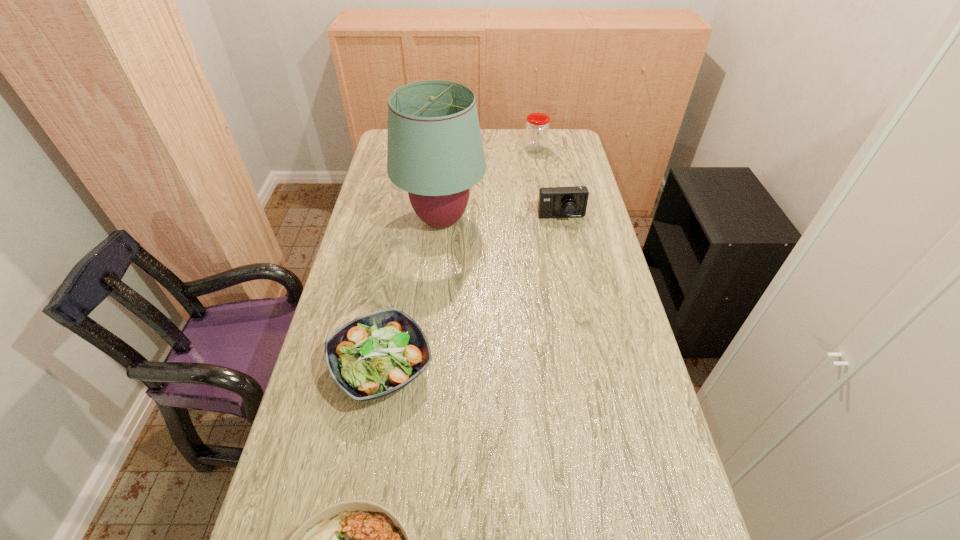
Where is `lampshade`? This screenshot has height=540, width=960. lampshade is located at coordinates (435, 152).

Where is `jar`? This screenshot has width=960, height=540. jar is located at coordinates (537, 127).

At what (x,y) coordinates should I click in order to perform the action: click on the fourth shortest object. Please return your answer as a coordinate pair (x, y). Looking at the image, I should click on (537, 127).

Locate an element on the screen. camera is located at coordinates (554, 202).

The width and height of the screenshot is (960, 540). In order to click on the fourth farthest object in this screenshot , I will do `click(372, 356)`.

Identify the location of the second shortest object. This screenshot has width=960, height=540. (372, 356).

The image size is (960, 540). I want to click on vacant space located on the back of the lampshade, so (x=446, y=165).

In order to click on free point located on the right of the jar in this screenshot , I will do 578,150.

Find the location of a particular element. vacant space located on the front-facing side of the camera is located at coordinates (575, 285).

You are a GUI agent. You are given a task and a screenshot of the screen. Output one action in this format:
    pyautogui.click(x=<x>, y=<y>)
    Task: Click on the free space located 0.110m on the front of the fourth tallest object
    This screenshot has width=960, height=540.
    Given the screenshot: What is the action you would take?
    pyautogui.click(x=365, y=463)